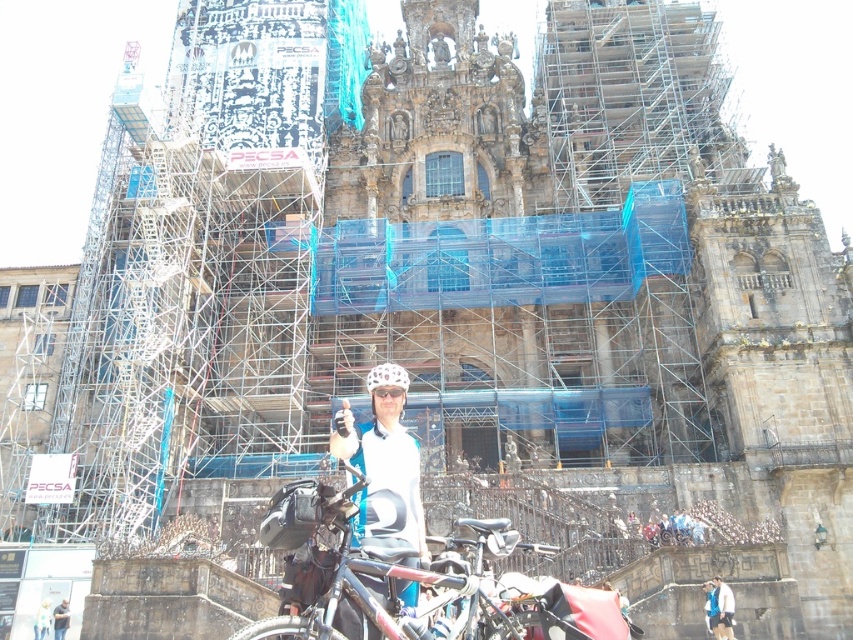
Does white fabric jacket at lower right appear over dark gray helmet at center?

Yes, white fabric jacket at lower right is above dark gray helmet at center.

Is white fabric jacket at lower right closer to the viewer compared to dark gray helmet at center?

Yes.

Is point (722, 604) closer to camera compared to point (67, 625)?

Yes, it is.

Identify the location of white fabric jacket at lower right. This screenshot has width=853, height=640. (723, 609).

Who is higher up, shiny black bicycle at center or white matte helmet at center?

white matte helmet at center is above.

Image resolution: width=853 pixels, height=640 pixels. What do you see at coordinates (396, 579) in the screenshot? I see `shiny black bicycle at center` at bounding box center [396, 579].

The width and height of the screenshot is (853, 640). What are the coordinates of `shiny black bicycle at center` in the screenshot? It's located at (396, 579).

Identify the location of shiny black bicycle at center. The width and height of the screenshot is (853, 640). (396, 579).

Does white fabric jacket at lower right appear over white helmet at center?

Yes, white fabric jacket at lower right is above white helmet at center.

Can you confirm if white fabric jacket at lower right is smaller than white helmet at center?

Actually, white fabric jacket at lower right might be larger than white helmet at center.

What do you see at coordinates (723, 609) in the screenshot? I see `white fabric jacket at lower right` at bounding box center [723, 609].

You are a GUI agent. You are given a task and a screenshot of the screen. Output one action in this format:
    pyautogui.click(x=<x>, y=<y>)
    Task: Click on the white fabric jacket at lower right
    The image size is (853, 640).
    Given the screenshot: What is the action you would take?
    pyautogui.click(x=723, y=609)